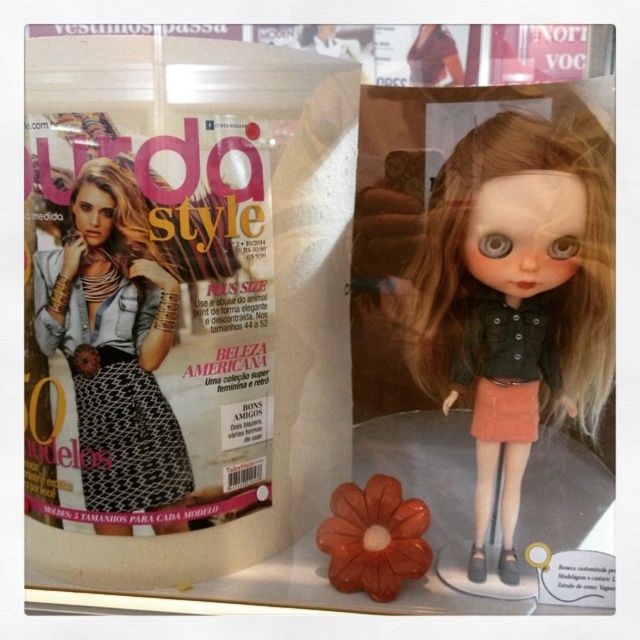
Question: Where is matte black doll at center located in relation to rubber-like flower at center in the image?

Choices:
 (A) above
 (B) below

Answer: (A)

Question: Which is nearer to the matte black doll at center?

Choices:
 (A) rubber-like flower at center
 (B) matte black dress at center

Answer: (B)

Question: Which of the following is the closest to the observer?

Choices:
 (A) (106, 500)
 (B) (333, 492)
 (C) (419, 380)

Answer: (A)

Question: Is matte black dress at center smaller than rubber-like flower at center?

Choices:
 (A) yes
 (B) no

Answer: (A)

Question: Does matte black doll at center appear under black textured dress at center?

Choices:
 (A) no
 (B) yes

Answer: (A)

Question: Based on their relative distances, which object is farther from the rubber-like flower at center?

Choices:
 (A) matte black doll at center
 (B) matte black dress at center
 (C) black textured dress at center

Answer: (C)